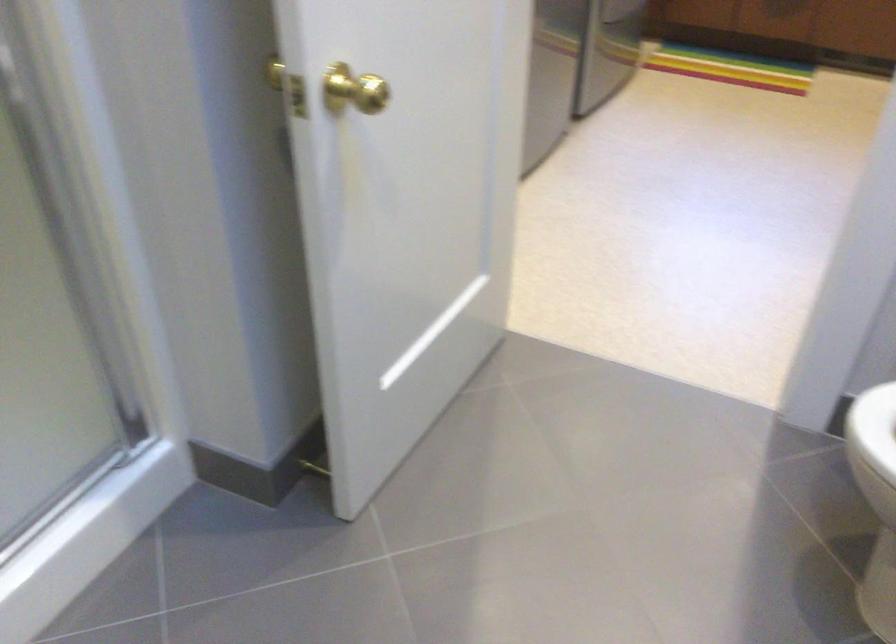
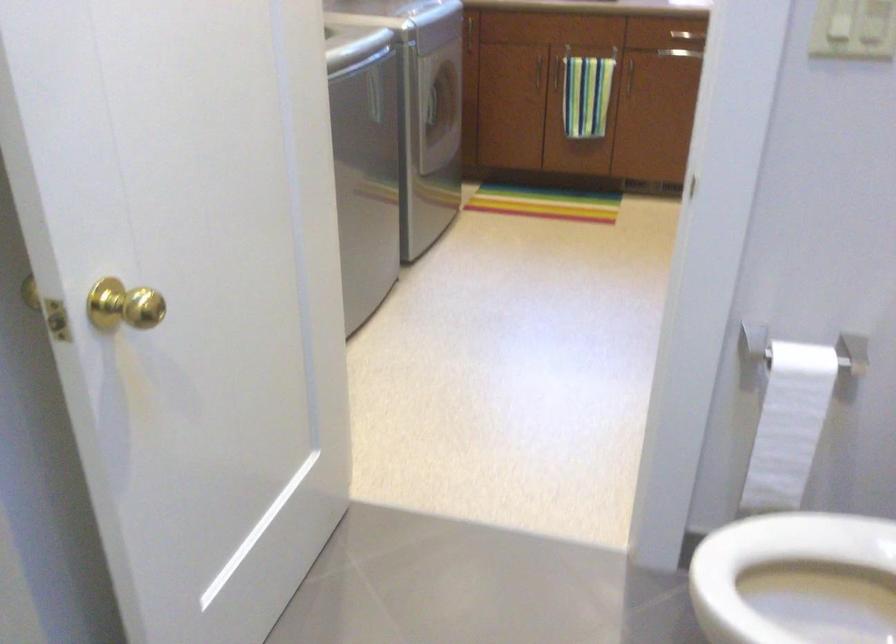
Consider the image. In a continuous first-person perspective shot, in which direction is the camera moving?

The cameraman moved toward right, forward.